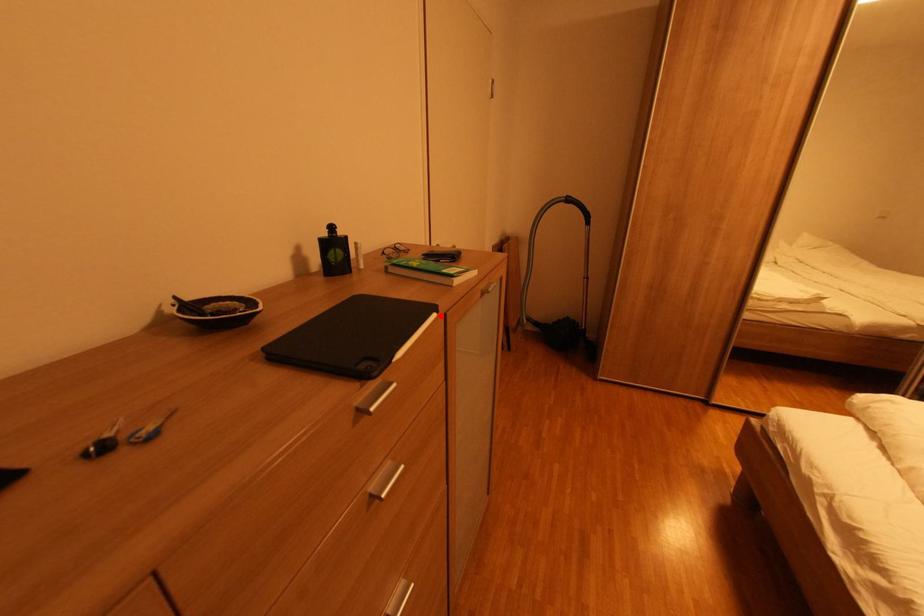
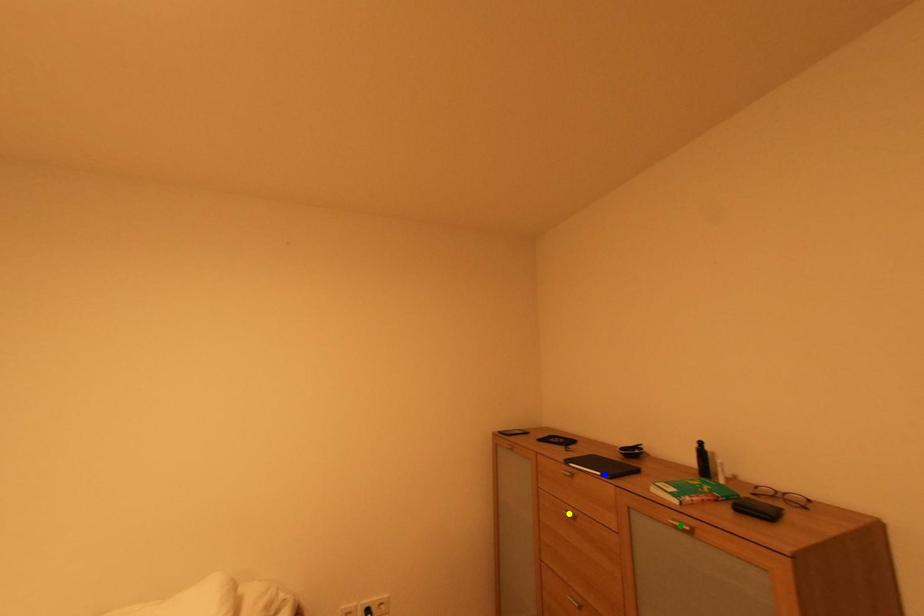
Question: I am providing you with two images of the same scene from different viewpoints. A red point is marked on the first image. You are given multiple points on the second image. Which spot in image 2 lines up with the point in image 1?

Choices:
 (A) blue point
 (B) green point
 (C) yellow point

Answer: (A)